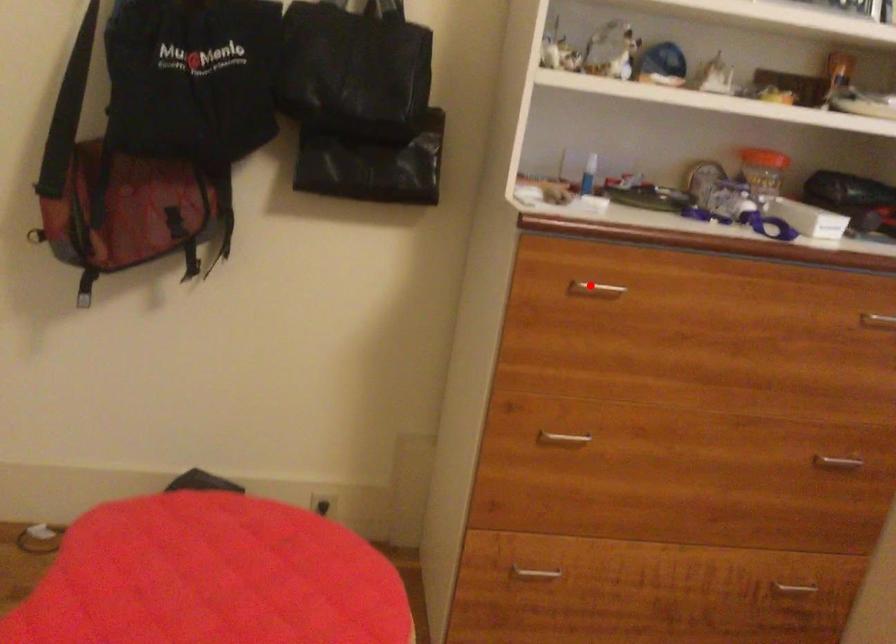
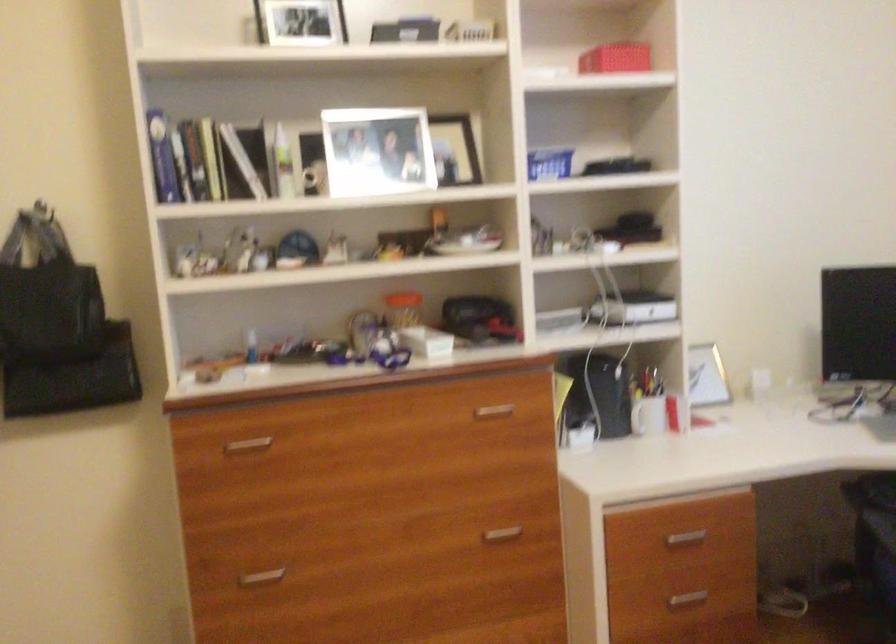
Find the pixel in the second image that matches the highlighted location in the first image.

(247, 444)